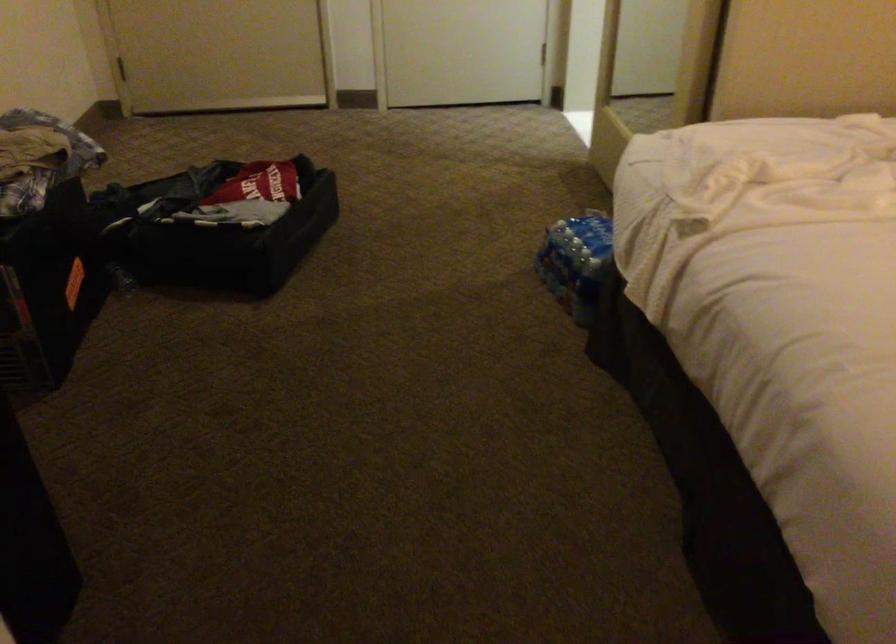
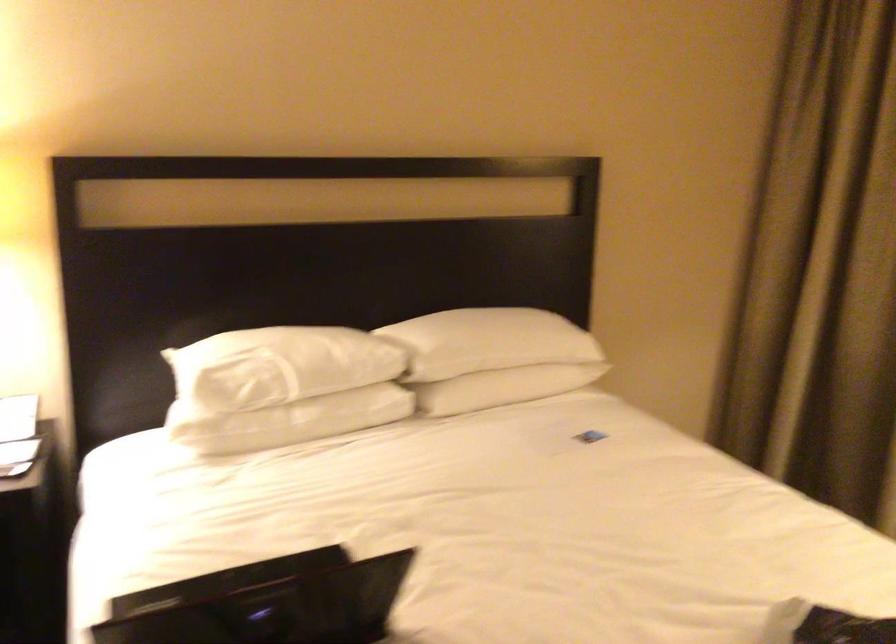
The images are taken continuously from a first-person perspective. In which direction is your viewpoint rotating?

The camera rotated toward right-down.